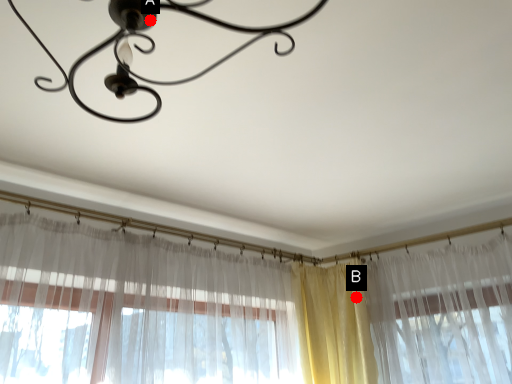
Question: Two points are circled on the image, labeled by A and B beside each circle. Which point is closer to the camera?

Choices:
 (A) A is closer
 (B) B is closer

Answer: (A)